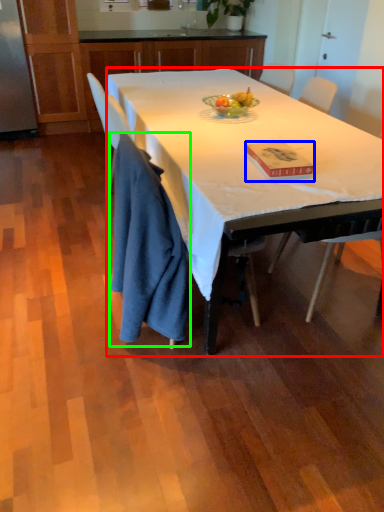
Question: Estimate the real-world distances between objects in this image. Which object is farther from desk (highlighted by a red box), book (highlighted by a blue box) or cloth (highlighted by a green box)?

Choices:
 (A) book
 (B) cloth

Answer: (B)